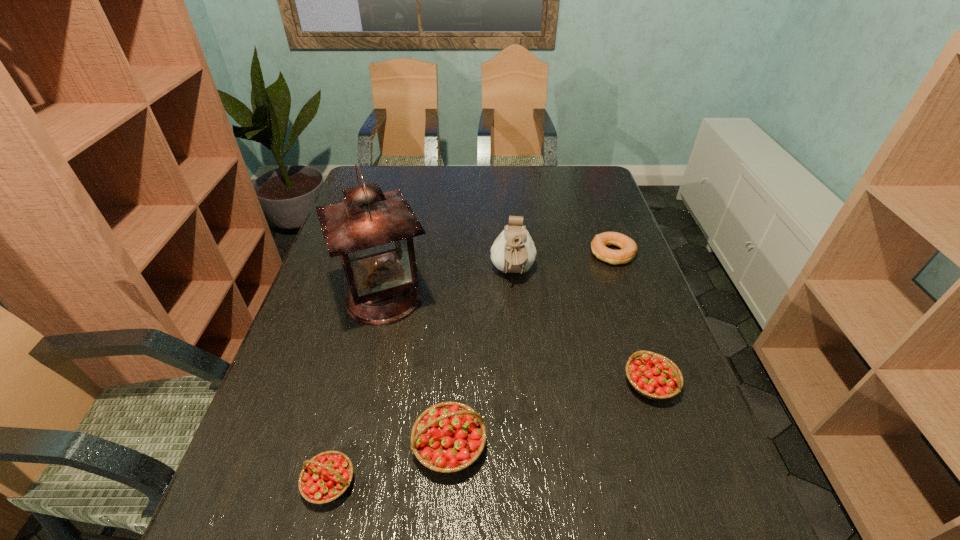
At what (x,y) coordinates should I click in order to perform the action: click on vacant space situated on the right of the shortest strawberry. Please return your answer as a coordinate pair (x, y). Looking at the image, I should click on (489, 483).

Find the location of a particular element. free region located 0.220m on the back of the second strawberry from left to right is located at coordinates (456, 334).

Find the location of a particular element. free location located 0.320m on the back of the fourth farthest object is located at coordinates (612, 272).

This screenshot has width=960, height=540. Find the location of `vacant position located on the left of the shortest object`. vacant position located on the left of the shortest object is located at coordinates (468, 254).

I want to click on free space located 0.370m on the right of the tallest object, so click(572, 298).

At what (x,y) coordinates should I click in order to perform the action: click on vacant space located 0.130m on the front-facing side of the fifth shortest object. Please return your answer as a coordinate pair (x, y). Image resolution: width=960 pixels, height=540 pixels. Looking at the image, I should click on (517, 327).

You are a GUI agent. You are given a task and a screenshot of the screen. Output one action in this format:
    pyautogui.click(x=<x>, y=<y>)
    Task: Click on the strawberry situated at the left edge
    This screenshot has width=960, height=540.
    Given the screenshot: What is the action you would take?
    pyautogui.click(x=325, y=477)

The height and width of the screenshot is (540, 960). Identify the location of oil lamp at the left edge. [372, 231].

Find the location of a particular element. This screenshot has height=540, width=960. strawberry at the right edge is located at coordinates click(652, 375).

Where is `bagel that is at the right edge`? The height and width of the screenshot is (540, 960). bagel that is at the right edge is located at coordinates (628, 247).